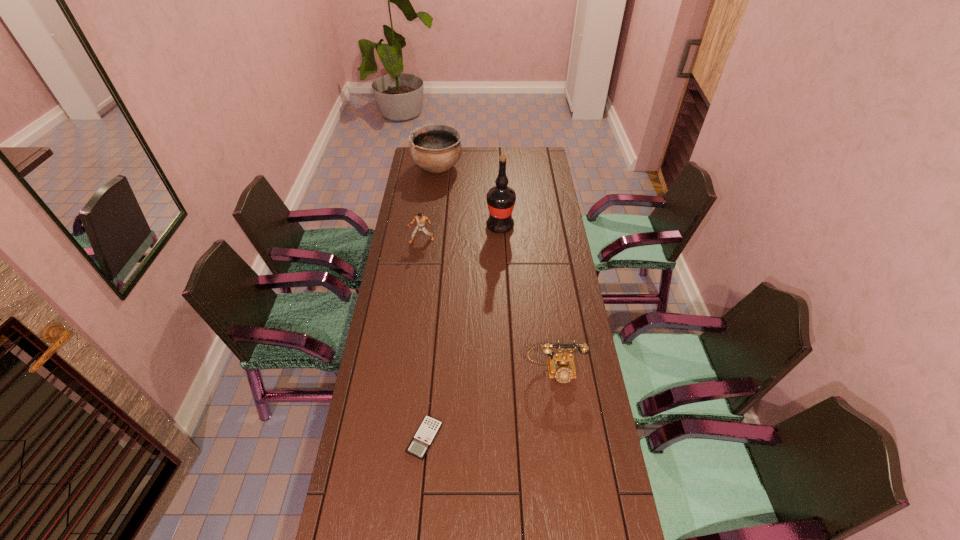
The image size is (960, 540). I want to click on free space located 0.160m on the dial number of the second nearest object, so click(563, 432).

The image size is (960, 540). In order to click on free spot located on the right of the calculator in this screenshot , I will do `click(532, 438)`.

This screenshot has height=540, width=960. Identify the location of object at the far edge. (435, 148).

This screenshot has height=540, width=960. Find the location of `pottery at the left edge`. pottery at the left edge is located at coordinates (435, 148).

At what (x,y) coordinates should I click in order to perform the action: click on puncher at the left edge. Please return your answer as a coordinate pair (x, y). The height and width of the screenshot is (540, 960). Looking at the image, I should click on (421, 220).

Locate an element on the screen. Image resolution: width=960 pixels, height=540 pixels. calculator that is at the left edge is located at coordinates (429, 428).

This screenshot has height=540, width=960. What are the coordinates of `object positioned at the right edge` in the screenshot? It's located at (561, 366).

Where is `object that is at the far left corner`? object that is at the far left corner is located at coordinates tap(435, 148).

At what (x,y) coordinates should I click in order to perform the action: click on free space at the far edge of the desktop. Please return your answer as a coordinate pair (x, y). The height and width of the screenshot is (540, 960). Looking at the image, I should click on (482, 160).

The image size is (960, 540). In the image, there is a desktop. What are the coordinates of `vacant space at the left edge` in the screenshot? It's located at (383, 357).